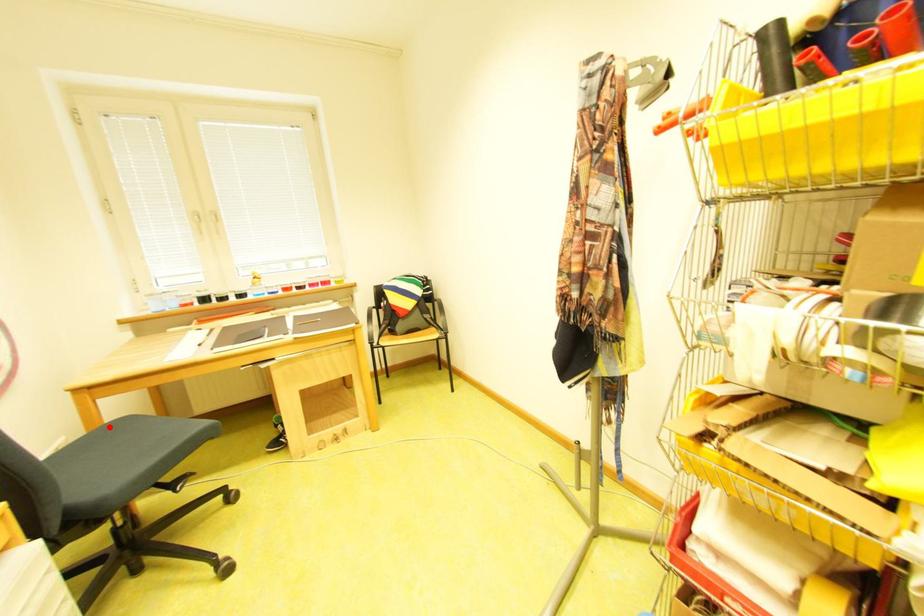
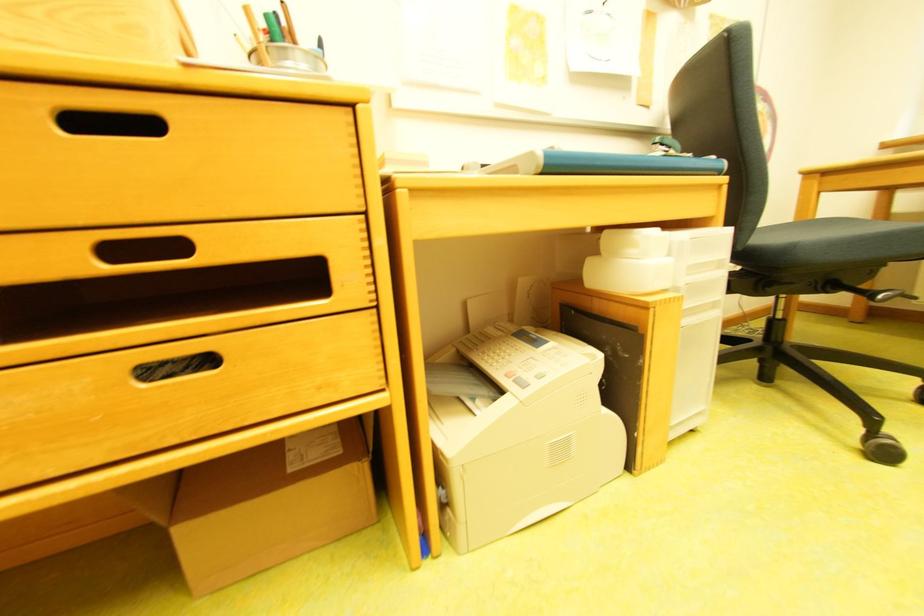
Question: I am providing you with two images of the same scene from different viewpoints. Given a red point in image1, look at the same physical point in image2. Is it:

Choices:
 (A) Closer to the viewpoint
 (B) Farther from the viewpoint

Answer: (B)